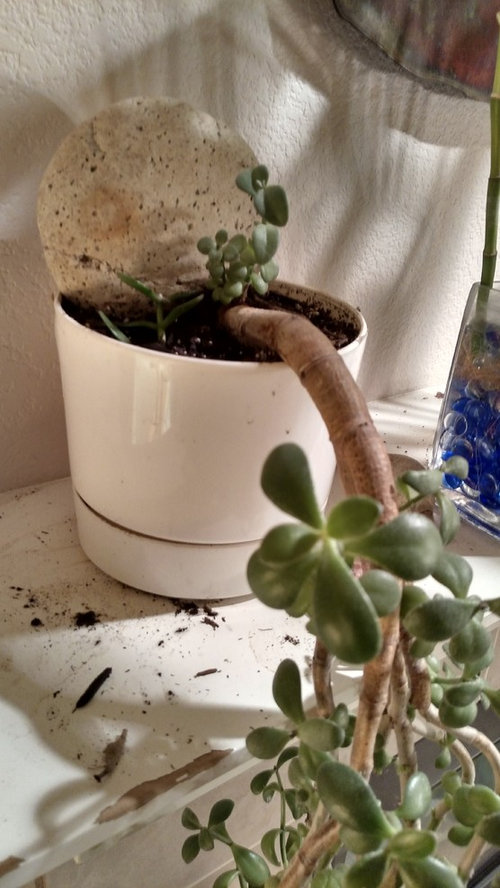
The width and height of the screenshot is (500, 888). I want to click on small green plant, so click(x=160, y=318).